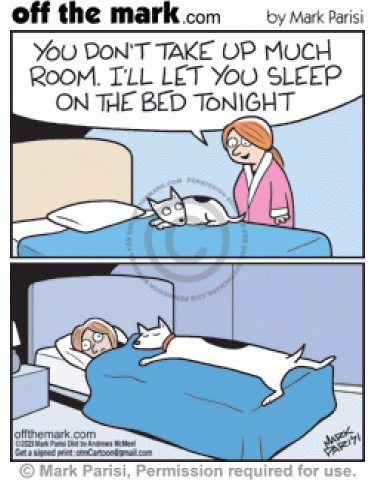
This screenshot has width=380, height=480. Identify the location of corners of upper panel. (363, 258), (10, 255), (11, 31), (361, 32).